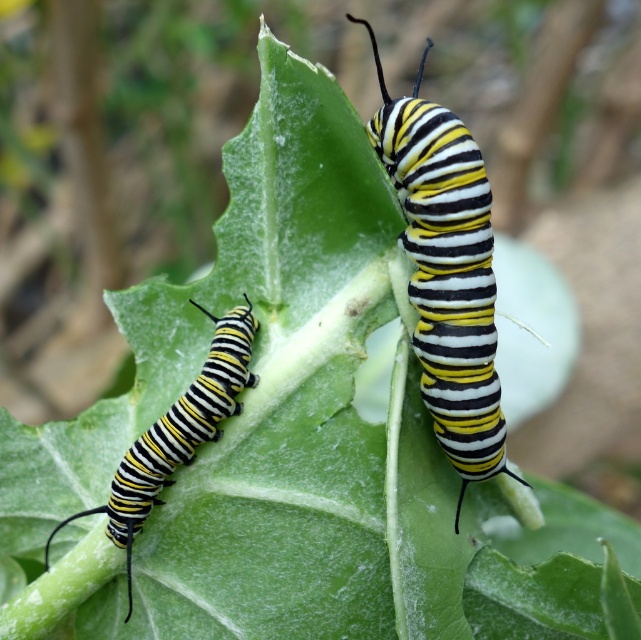
Between yellow-black-striped caterpillar at center and yellow-black-striped caterpillar at left, which one is positioned higher?

yellow-black-striped caterpillar at center is higher up.

Is yellow-black-striped caterpillar at center shorter than yellow-black-striped caterpillar at left?

Incorrect, yellow-black-striped caterpillar at center's height does not fall short of yellow-black-striped caterpillar at left's.

The image size is (641, 640). What do you see at coordinates (445, 273) in the screenshot?
I see `yellow-black-striped caterpillar at center` at bounding box center [445, 273].

Where is `yellow-black-striped caterpillar at center`? This screenshot has height=640, width=641. yellow-black-striped caterpillar at center is located at coordinates (445, 273).